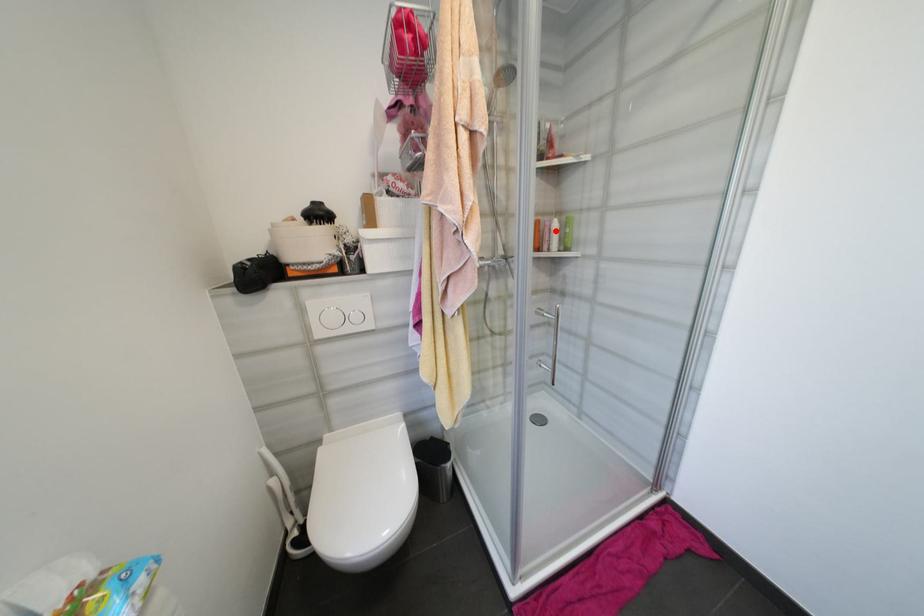
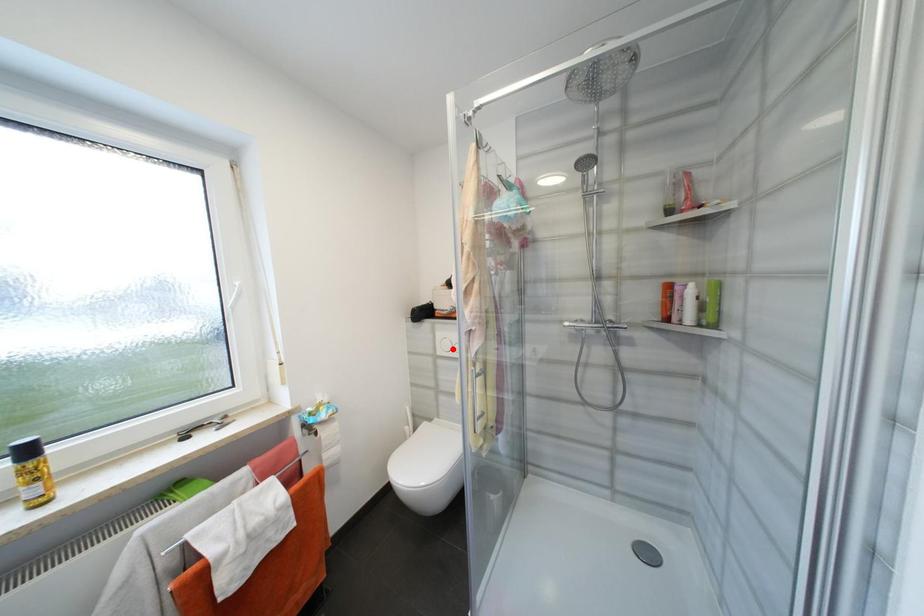
I am providing you with two images of the same scene from different viewpoints. A red point is marked on the first image and another point is marked on the second image. Is the red point in image1 aligned with the point shown in image2?

No